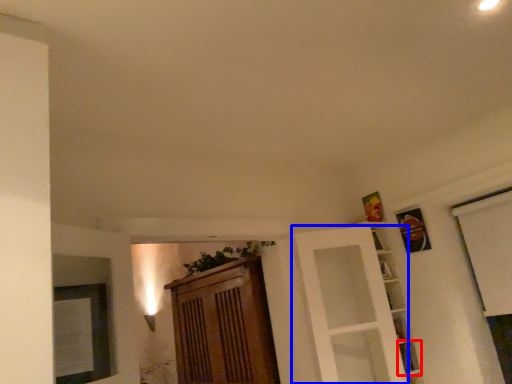
Question: Which point is further to the camera, shelf (highlighted by a red box) or door (highlighted by a blue box)?

Choices:
 (A) shelf
 (B) door

Answer: (A)